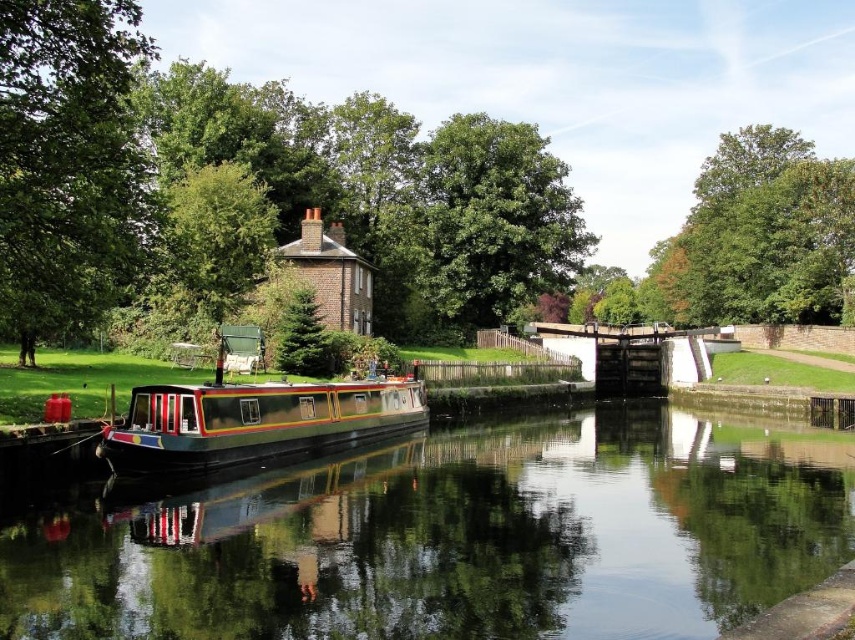
Question: Which point is farther from the camera taking this photo?

Choices:
 (A) (579, 627)
 (B) (705, 188)

Answer: (B)

Question: Which is farther from the green leafy tree at upper right?

Choices:
 (A) green glossy water at center
 (B) green leafy tree at upper left
 (C) metallic polished barge at center

Answer: (C)

Question: Considering the real-world distances, which object is closest to the green leafy tree at upper left?

Choices:
 (A) green leafy tree at upper right
 (B) green leafy tree at upper center

Answer: (B)

Question: Does green leafy tree at center lie in front of green leafy tree at upper left?

Choices:
 (A) no
 (B) yes

Answer: (A)

Question: Is green leafy tree at upper center bigger than green leafy tree at upper left?

Choices:
 (A) no
 (B) yes

Answer: (B)

Question: Does green glossy water at center have a smaller size compared to green leafy tree at center?

Choices:
 (A) no
 (B) yes

Answer: (B)